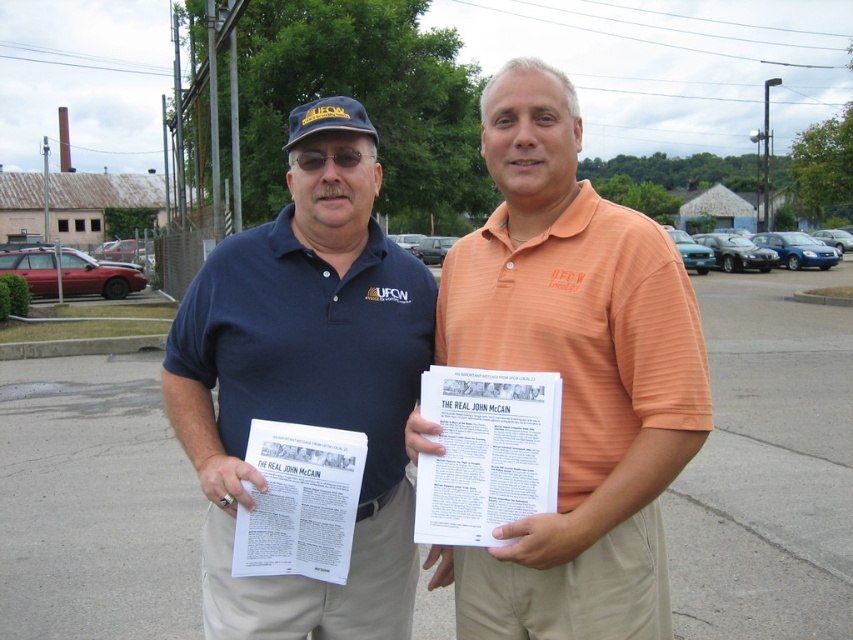
Can you confirm if orange striped polo shirt at center is smaller than matte blue shirt at center?

Actually, orange striped polo shirt at center might be larger than matte blue shirt at center.

This screenshot has width=853, height=640. Find the location of `orange striped polo shirt at center`. orange striped polo shirt at center is located at coordinates (572, 376).